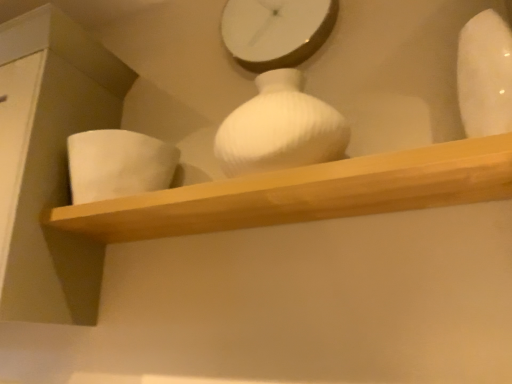
Question: From a real-world perspective, is white glossy clock at upper center physically located above or below white matte vase at left, acting as the 1th vase starting from the back?

Choices:
 (A) below
 (B) above

Answer: (B)

Question: From the image's perspective, is white glossy clock at upper center positioned above or below white matte vase at left, positioned as the 2th vase in right-to-left order?

Choices:
 (A) above
 (B) below

Answer: (A)

Question: Estimate the real-world distances between objects in this image. Which object is closer to the white matte vase at left, positioned as the 2th vase in right-to-left order?

Choices:
 (A) wooden shelf at center
 (B) white matte vase at upper right, which is the first vase in right-to-left order
 (C) white glossy clock at upper center

Answer: (A)

Question: Which object is the farthest from the white matte vase at left, acting as the 1th vase starting from the back?

Choices:
 (A) white matte vase at upper right, the 1th vase when ordered from front to back
 (B) white glossy clock at upper center
 (C) wooden shelf at center

Answer: (A)